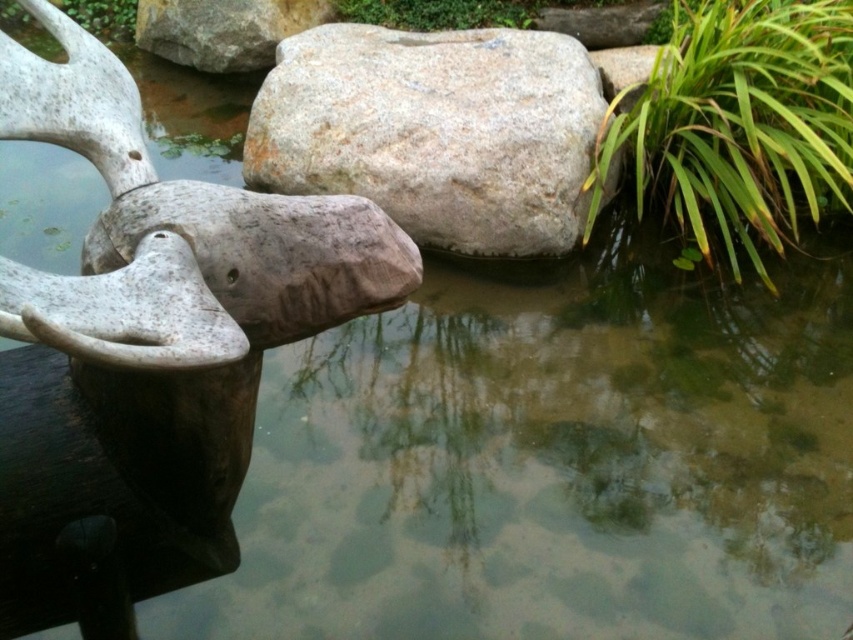
You are standing in the outdoor scene and want to place a small decorative item between the green leafy plant at right and the gray granite rock at upper center. Based on their positions, where should you place it to ensure it is between them?

The green leafy plant at right is positioned on the right side of gray granite rock at upper center, so placing the item to the left of the green leafy plant at right and to the right of the gray granite rock at upper center would place it between them.